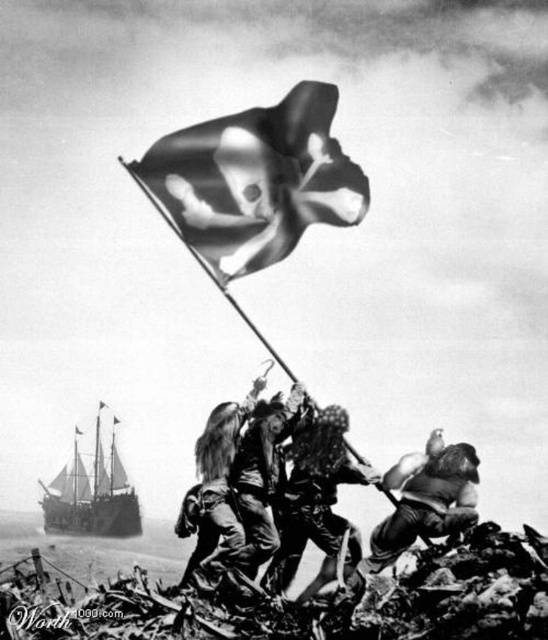
You are a soldier standing at point (274, 428). You need to reach the ship in the background. The distance between you and the ship is 91.97 meters. Can you estimate how far you are from the ship in meters?

The distance between the point (274, 428) and the ship is 91.97 meters, so you are 91.97 meters away from the ship.